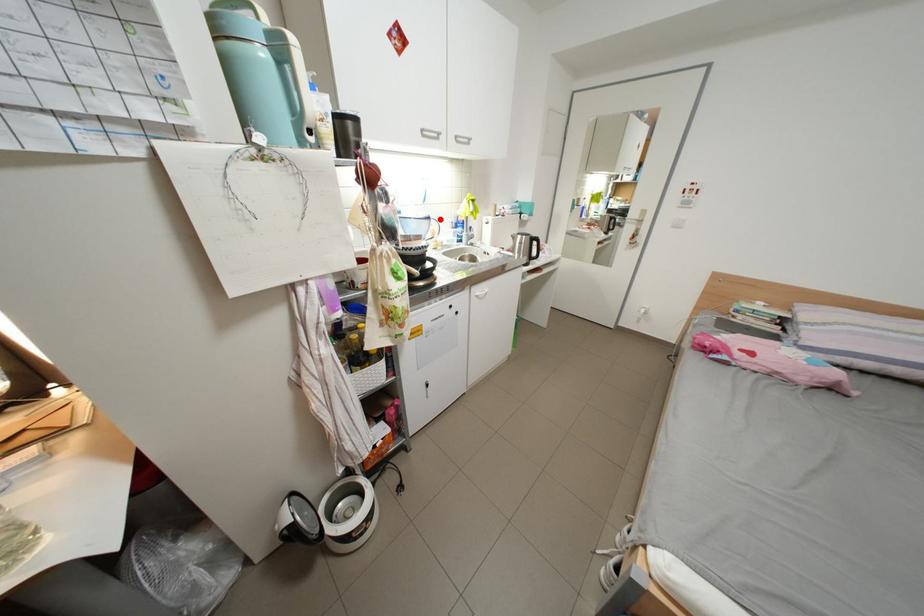
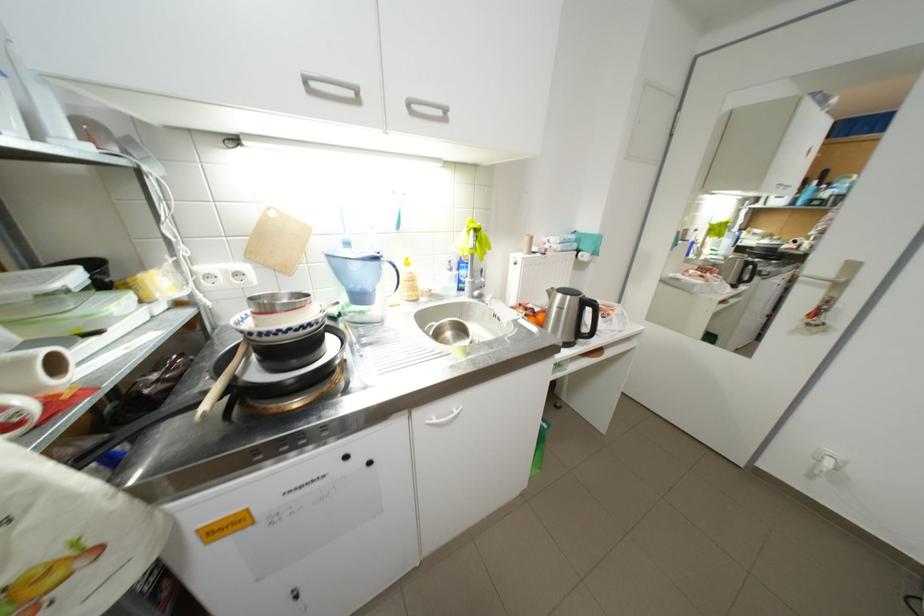
Locate, in the second image, the point that corresponds to the highlighted location in the first image.

(387, 259)